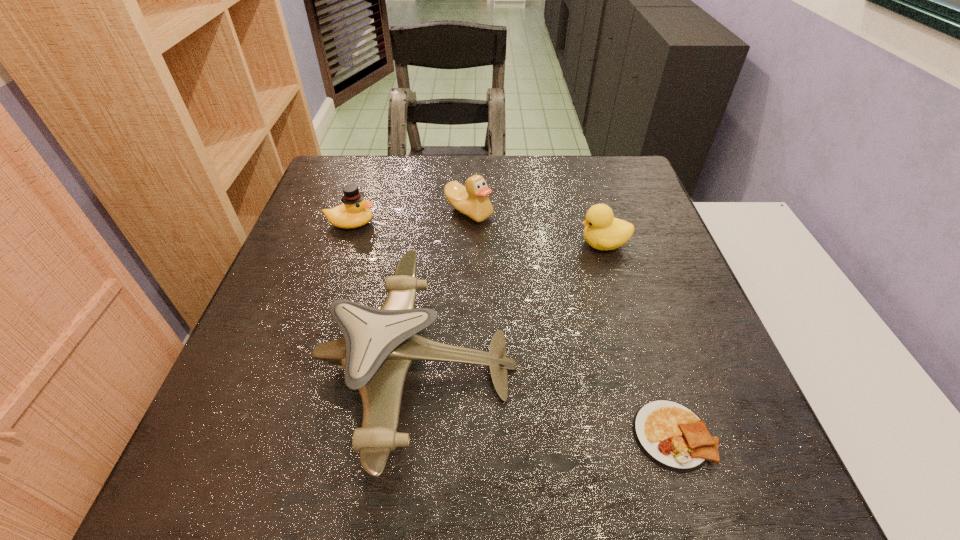
Identify which object is the fourth closest to the shortest object. Please provide its 2D coordinates. Your answer should be formatted as a tuple, i.e. [(x, y)], where the tuple contains the x and y coordinates of a point satisfying the conditions above.

[(355, 212)]

Identify which duck is located as the nearest to the second duck from right to left. Please provide its 2D coordinates. Your answer should be formatted as a tuple, i.e. [(x, y)], where the tuple contains the x and y coordinates of a point satisfying the conditions above.

[(355, 212)]

The image size is (960, 540). Identify the location of duck that is the nearest to the second duck from right to left. (x=355, y=212).

The width and height of the screenshot is (960, 540). Identify the location of free region that satisfies the following two spatial constraints: 1. on the front-facing side of the drone; 2. on the right side of the shortest object. (410, 435).

This screenshot has width=960, height=540. What are the coordinates of `free space that satisfies the following two spatial constraints: 1. on the front-facing side of the omelet; 2. on the left side of the drone` in the screenshot? It's located at (410, 435).

Identify the location of vacant region that satisfies the following two spatial constraints: 1. at the beak of the second duck from right to left; 2. on the front-facing side of the leftmost duck. (468, 223).

The height and width of the screenshot is (540, 960). Identify the location of free point that satisfies the following two spatial constraints: 1. on the front-facing side of the drone; 2. on the left side of the omelet. (410, 435).

This screenshot has width=960, height=540. I want to click on vacant area in the image that satisfies the following two spatial constraints: 1. on the front-facing side of the drone; 2. on the right side of the omelet, so click(410, 435).

Where is `free location that satisfies the following two spatial constraints: 1. at the beak of the second duck from left to right; 2. on the front-facing side of the drone`? Image resolution: width=960 pixels, height=540 pixels. free location that satisfies the following two spatial constraints: 1. at the beak of the second duck from left to right; 2. on the front-facing side of the drone is located at coordinates (465, 366).

Locate an element on the screen. free space that satisfies the following two spatial constraints: 1. at the beak of the second duck from right to left; 2. on the front-facing side of the drone is located at coordinates (465, 366).